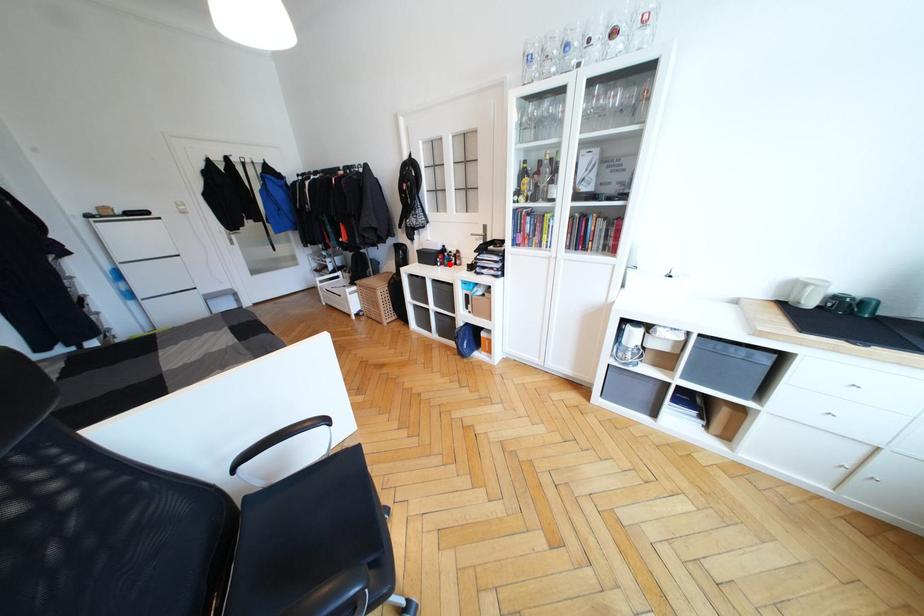
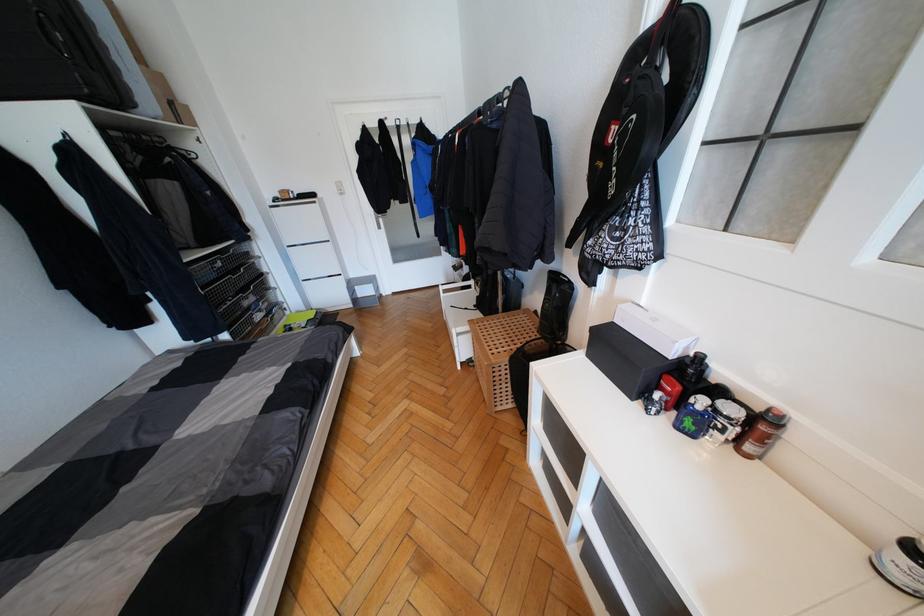
Locate, in the second image, the point that corresponds to the highlighted location in the first image.

(691, 426)